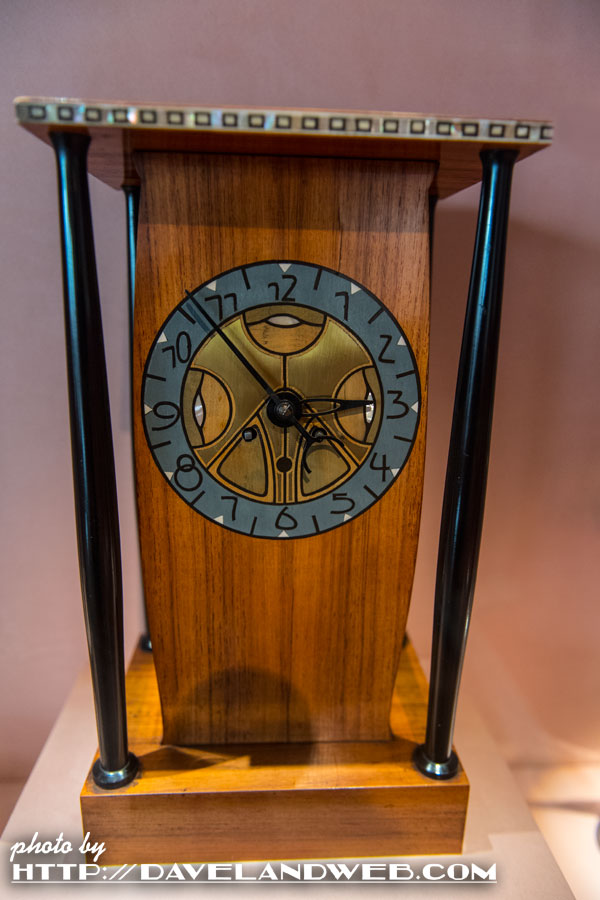
The image size is (600, 900). What are the coordinates of `photo of clock` in the screenshot? It's located at (286, 579), (272, 195).